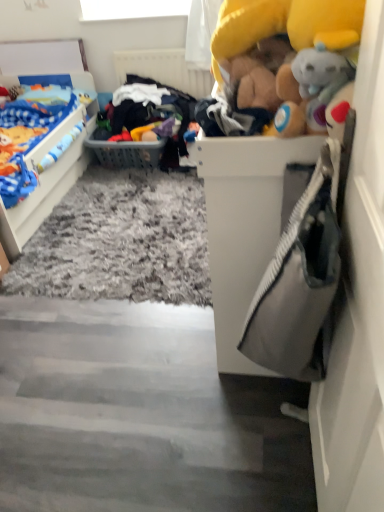
Question: Is yellow plush toy at upper right, the first toy in the front-to-back sequence, in contact with white matte door at right?

Choices:
 (A) no
 (B) yes

Answer: (A)

Question: Is yellow plush toy at upper right, the first toy in the front-to-back sequence, turned away from white matte door at right?

Choices:
 (A) yes
 (B) no

Answer: (B)

Question: From the image's perspective, would you say yellow plush toy at upper right, the first toy in the front-to-back sequence, is positioned over white matte door at right?

Choices:
 (A) no
 (B) yes

Answer: (B)

Question: From a real-world perspective, is yellow plush toy at upper right, the first toy in the front-to-back sequence, under white matte door at right?

Choices:
 (A) yes
 (B) no

Answer: (B)

Question: Is yellow plush toy at upper right, the first toy in the front-to-back sequence, smaller than white matte door at right?

Choices:
 (A) yes
 (B) no

Answer: (B)

Question: Is the depth of white matte door at right greater than that of white textured radiator at upper center?

Choices:
 (A) yes
 (B) no

Answer: (B)

Question: Does white matte door at right turn towards white textured radiator at upper center?

Choices:
 (A) no
 (B) yes

Answer: (A)

Question: Does white matte door at right have a greater width compared to white textured radiator at upper center?

Choices:
 (A) no
 (B) yes

Answer: (B)

Question: Are white matte door at right and white textured radiator at upper center making contact?

Choices:
 (A) yes
 (B) no

Answer: (B)

Question: Does white matte door at right appear on the left side of white textured radiator at upper center?

Choices:
 (A) no
 (B) yes

Answer: (A)

Question: Can you confirm if white matte door at right is taller than white textured radiator at upper center?

Choices:
 (A) yes
 (B) no

Answer: (A)

Question: Is shaggy carpet at lower center oriented towards gray plastic basket at center?

Choices:
 (A) no
 (B) yes

Answer: (A)